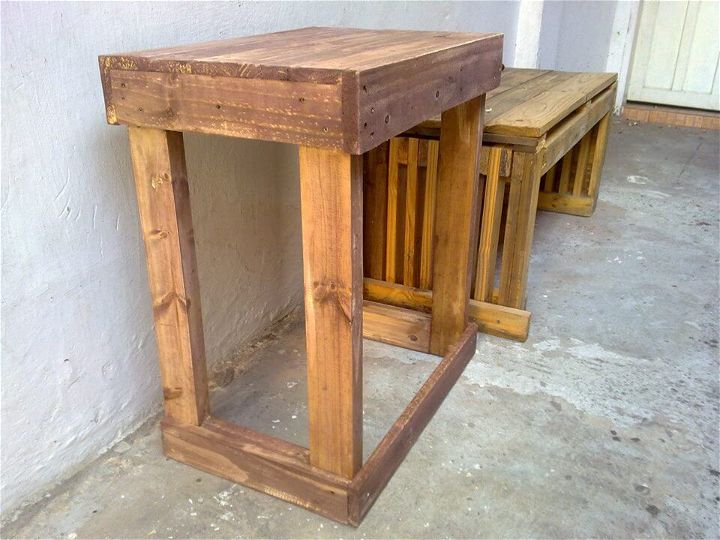
The image size is (720, 540). Identify the location of white wall. (251, 260).